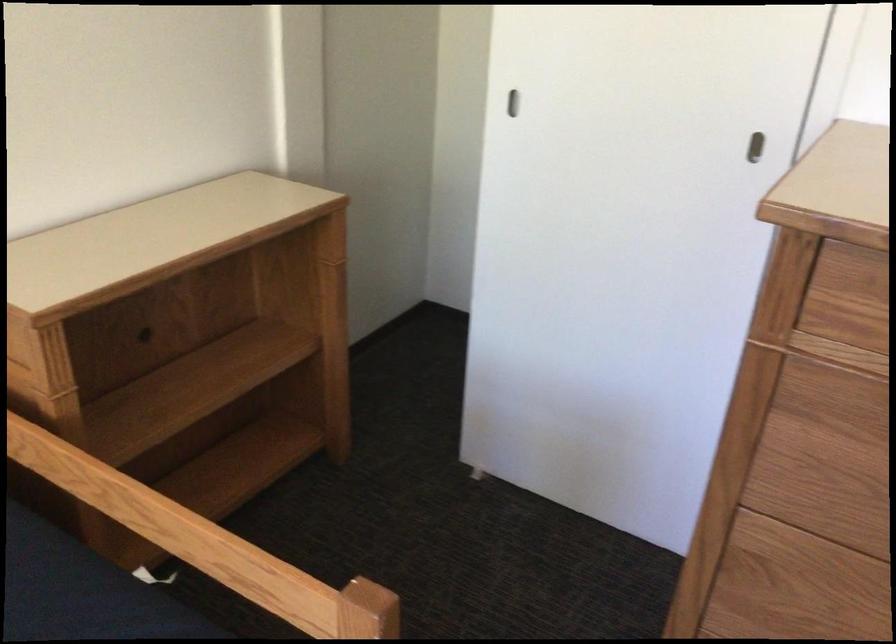
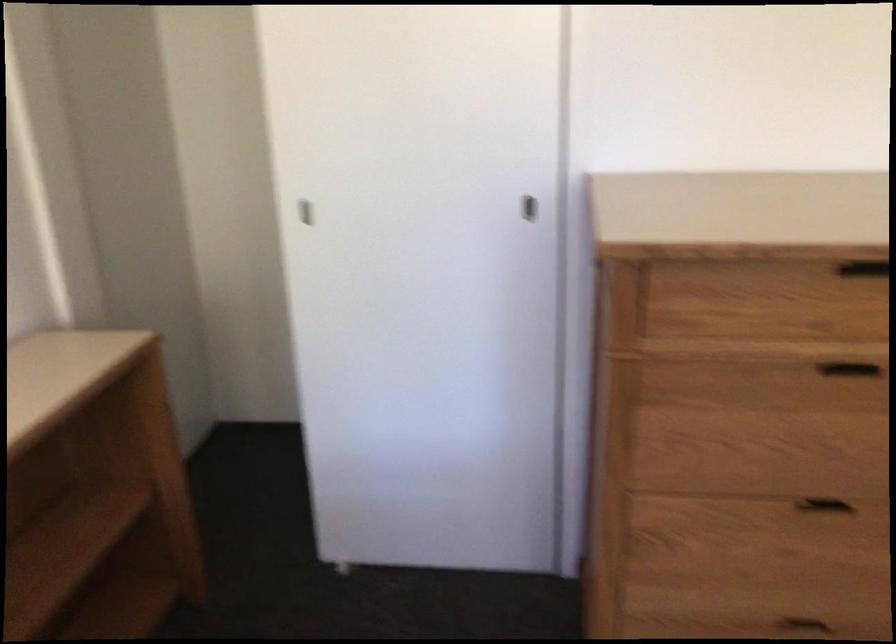
Question: The first image is from the beginning of the video and the second image is from the end. How did the camera likely rotate when shooting the video?

Choices:
 (A) Left
 (B) Right
 (C) Up
 (D) Down

Answer: (B)